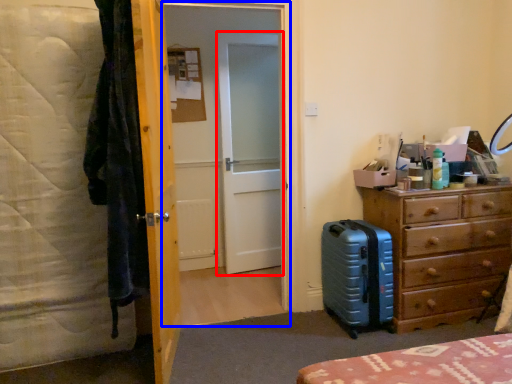
Question: Among these objects, which one is farthest to the camera, screen door (highlighted by a red box) or screen door (highlighted by a blue box)?

Choices:
 (A) screen door
 (B) screen door

Answer: (A)